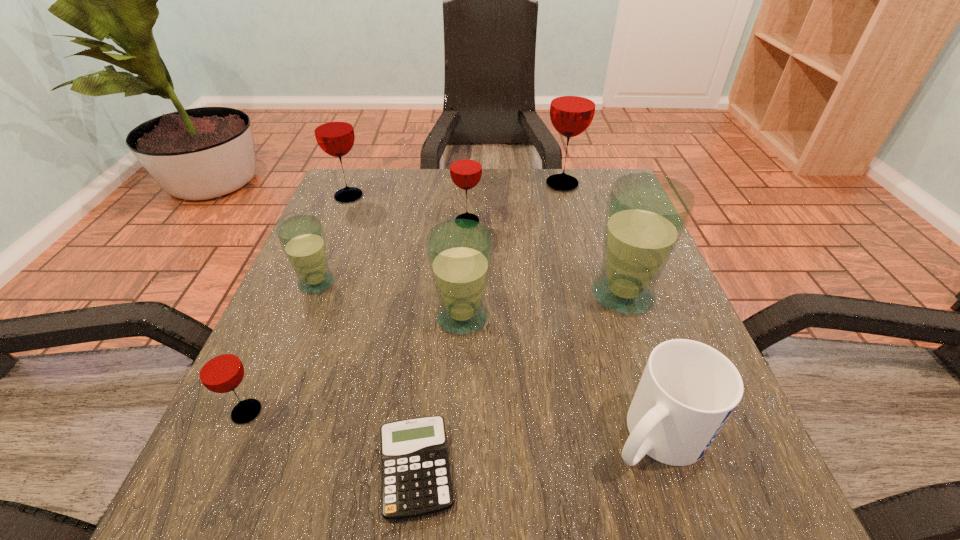
At what (x,y) coordinates should I click in order to perform the action: click on the rightmost red glass. Please return your answer as a coordinate pair (x, y). This screenshot has height=540, width=960. Looking at the image, I should click on coord(572,108).

Locate an element on the screen. the tallest glass is located at coordinates (572, 108).

Find the location of `the third smallest red glass`. the third smallest red glass is located at coordinates (333, 129).

Image resolution: width=960 pixels, height=540 pixels. What are the coordinates of `the rightmost blue glass` in the screenshot? It's located at (646, 215).

Where is `the third farthest object`? Image resolution: width=960 pixels, height=540 pixels. the third farthest object is located at coordinates (465, 168).

Locate an element on the screen. This screenshot has width=960, height=540. the second nearest red glass is located at coordinates (465, 168).

Find the location of a particular element. the second biggest blue glass is located at coordinates (459, 251).

Identify the location of the smallest blue glass. The width and height of the screenshot is (960, 540). (302, 238).

Image resolution: width=960 pixels, height=540 pixels. What are the coordinates of `the smallest red glass` in the screenshot? It's located at (220, 370).

Where is `the nearest red glass`? the nearest red glass is located at coordinates (220, 370).